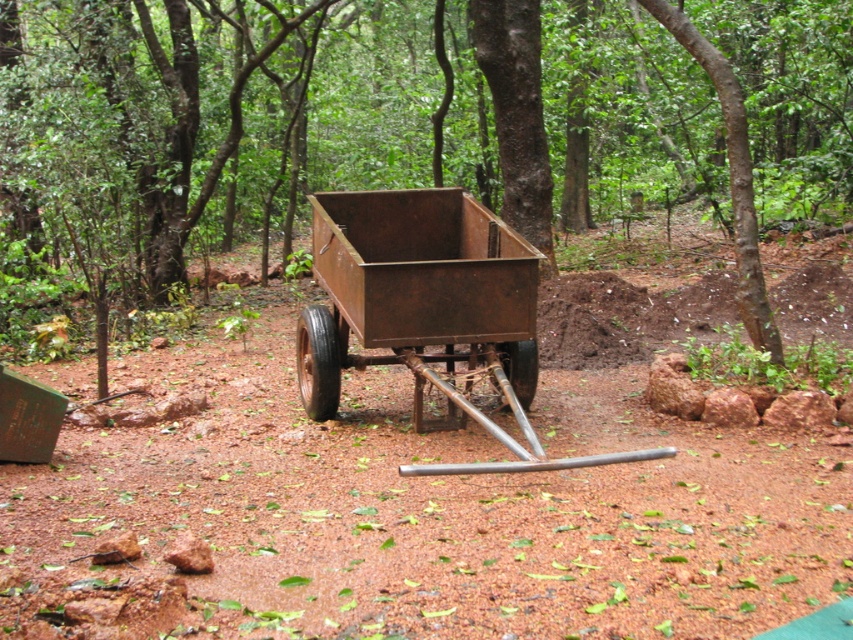
Question: Does rusty metal cart at center have a lesser width compared to rusty metal wagon at center?

Choices:
 (A) yes
 (B) no

Answer: (B)

Question: Which object appears closest to the camera in this image?

Choices:
 (A) rusty metal cart at center
 (B) rusty metal wagon at center

Answer: (B)

Question: Can you confirm if rusty metal cart at center is positioned to the left of rusty metal wagon at center?

Choices:
 (A) no
 (B) yes

Answer: (A)

Question: Among these points, which one is farthest from the camera?

Choices:
 (A) [x=412, y=340]
 (B) [x=9, y=182]

Answer: (B)

Question: Does rusty metal cart at center appear on the right side of rusty metal wagon at center?

Choices:
 (A) yes
 (B) no

Answer: (A)